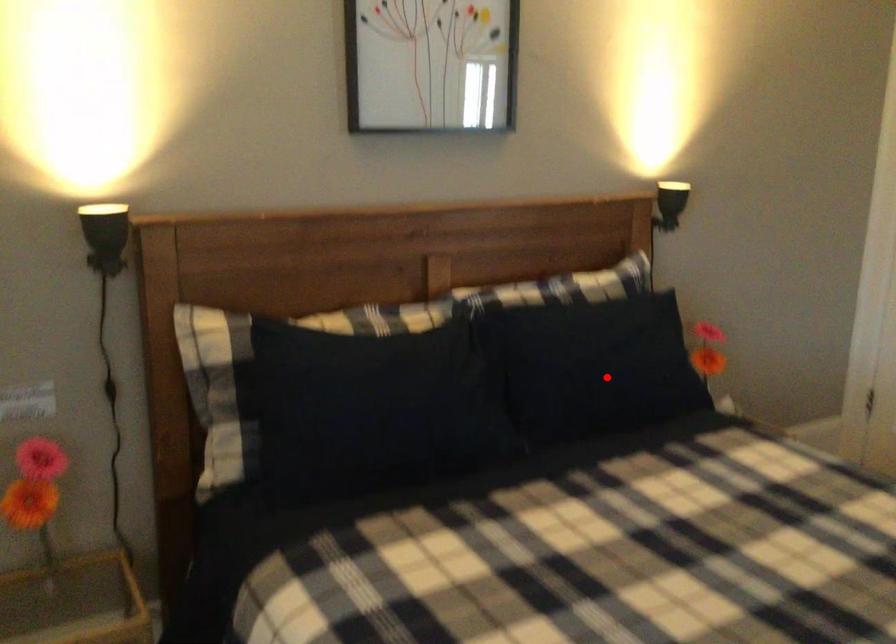
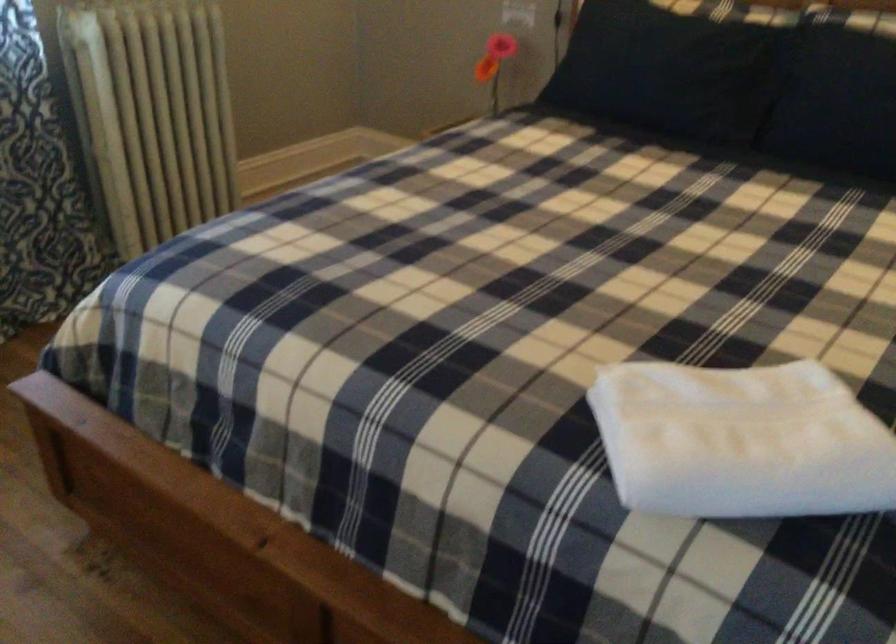
Find the pixel in the second image that matches the highlighted location in the first image.

(839, 104)